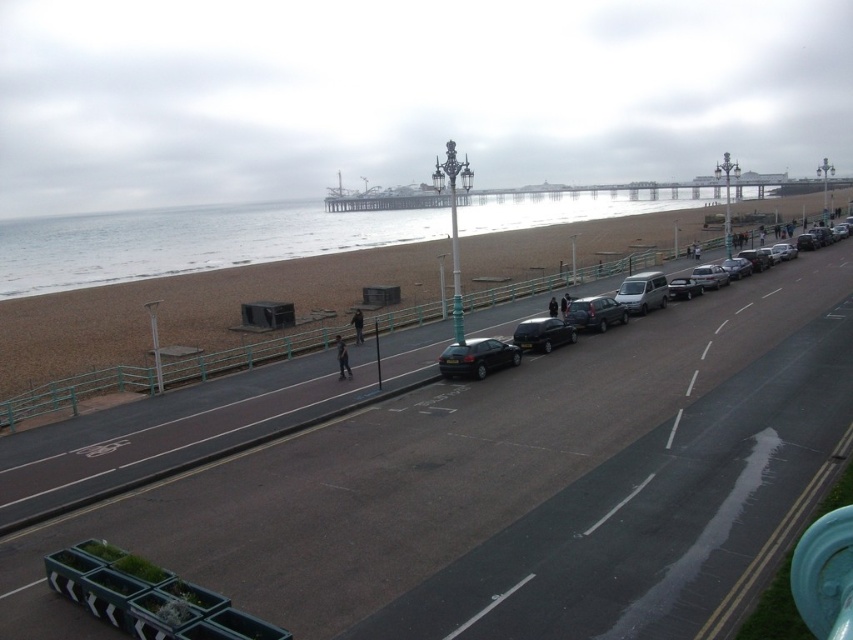
Identify the location of satin silver van at center. The height and width of the screenshot is (640, 853). (642, 292).

Is satin silver van at center below metallic silver sedan at center-right?

Yes.

Between point (656, 273) and point (704, 266), which one is positioned in front?

Point (656, 273) is more forward.

The image size is (853, 640). Find the location of `satin silver van at center`. satin silver van at center is located at coordinates pos(642,292).

Measure the distance between shiny black sedan at center and shiny silver sedan at center.

The distance of shiny black sedan at center from shiny silver sedan at center is 40.76 feet.

What do you see at coordinates (543, 333) in the screenshot? I see `shiny black sedan at center` at bounding box center [543, 333].

What do you see at coordinates (543, 333) in the screenshot?
I see `shiny black sedan at center` at bounding box center [543, 333].

Where is `shiny black sedan at center`? Image resolution: width=853 pixels, height=640 pixels. shiny black sedan at center is located at coordinates (543, 333).

Does brown sand at lower left have a greater height compared to satin silver van at center?

Yes.

Can you confirm if brown sand at lower left is positioned above satin silver van at center?

Yes.

Which is in front, point (601, 273) or point (650, 307)?

Point (650, 307) is in front.

Find the location of a particular element. Image resolution: width=853 pixels, height=640 pixels. brown sand at lower left is located at coordinates (234, 292).